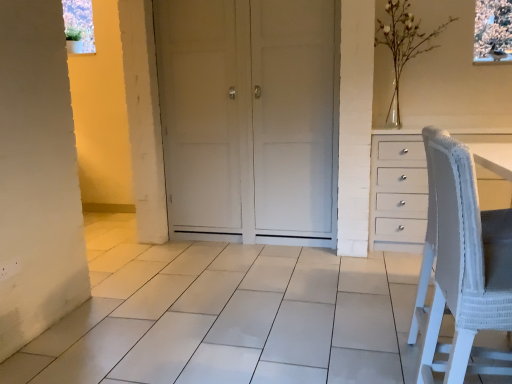
Question: Is white woven fabric chair at right completely or partially outside of white matte door at center?

Choices:
 (A) yes
 (B) no

Answer: (A)

Question: Is white woven fabric chair at right positioned in front of white matte door at center?

Choices:
 (A) yes
 (B) no

Answer: (A)

Question: Considering the relative sizes of white woven fabric chair at right and white matte door at center in the image provided, is white woven fabric chair at right shorter than white matte door at center?

Choices:
 (A) no
 (B) yes

Answer: (B)

Question: Considering the relative sizes of white woven fabric chair at right and white matte door at center in the image provided, is white woven fabric chair at right bigger than white matte door at center?

Choices:
 (A) yes
 (B) no

Answer: (B)

Question: Considering the relative sizes of white woven fabric chair at right and white matte door at center in the image provided, is white woven fabric chair at right thinner than white matte door at center?

Choices:
 (A) yes
 (B) no

Answer: (A)

Question: From the image's perspective, is white woven fabric chair at right above white matte door at center?

Choices:
 (A) yes
 (B) no

Answer: (B)

Question: Considering the relative sizes of white matte door at center and white woven fabric chair at right in the image provided, is white matte door at center wider than white woven fabric chair at right?

Choices:
 (A) no
 (B) yes

Answer: (B)

Question: From the image's perspective, is white matte door at center on white woven fabric chair at right?

Choices:
 (A) yes
 (B) no

Answer: (A)

Question: Can you confirm if white matte door at center is thinner than white woven fabric chair at right?

Choices:
 (A) no
 (B) yes

Answer: (A)

Question: Considering the relative sizes of white matte door at center and white woven fabric chair at right in the image provided, is white matte door at center taller than white woven fabric chair at right?

Choices:
 (A) no
 (B) yes

Answer: (B)

Question: Are white matte door at center and white woven fabric chair at right far apart?

Choices:
 (A) no
 (B) yes

Answer: (B)

Question: From a real-world perspective, is white matte door at center on white woven fabric chair at right?

Choices:
 (A) yes
 (B) no

Answer: (A)

Question: Is the surface of white glass vase at upper right in direct contact with white matte door at center?

Choices:
 (A) yes
 (B) no

Answer: (B)